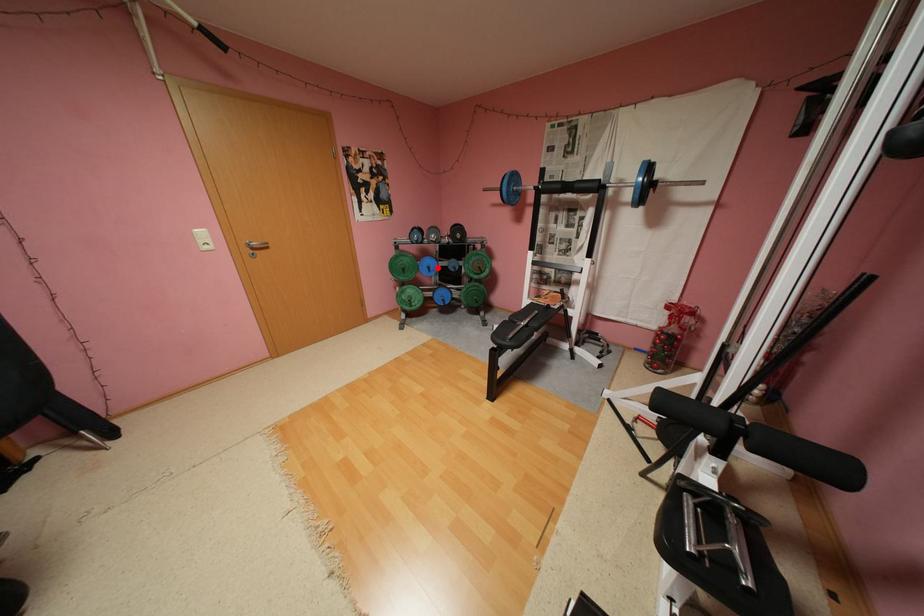
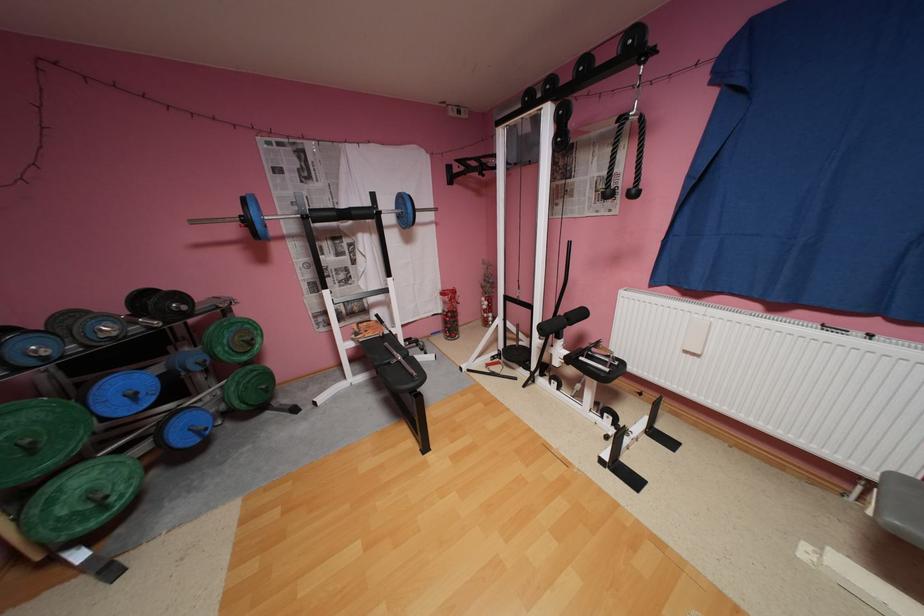
Locate, in the second image, the point that corresponds to the highlighted location in the first image.

(142, 395)